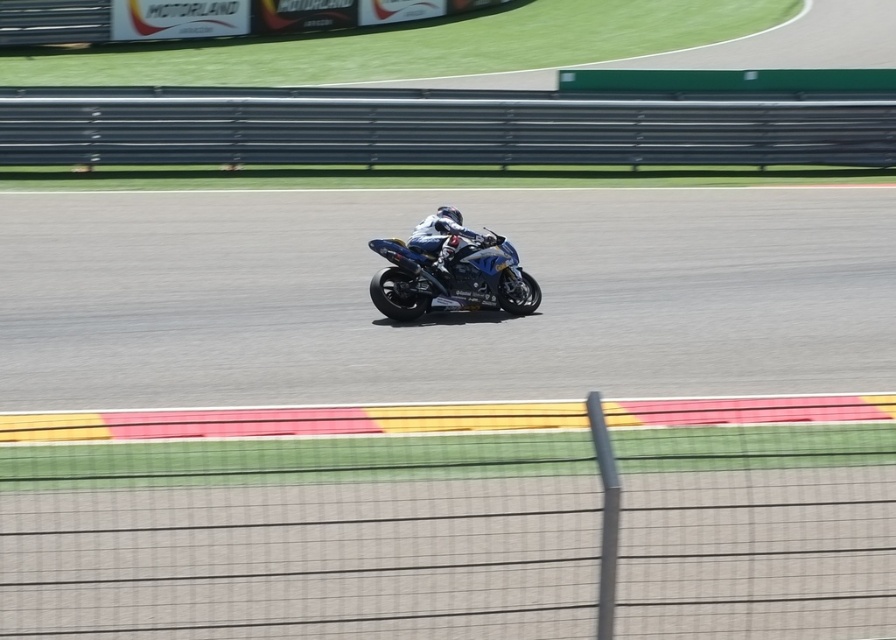
Question: Is blue metallic motorcycle at center positioned behind white matte helmet at center?

Choices:
 (A) yes
 (B) no

Answer: (B)

Question: Among these points, which one is nearest to the camera?

Choices:
 (A) (468, 236)
 (B) (526, 308)

Answer: (A)

Question: Does blue metallic motorcycle at center appear on the right side of white matte helmet at center?

Choices:
 (A) yes
 (B) no

Answer: (A)

Question: Can you confirm if blue metallic motorcycle at center is smaller than white matte helmet at center?

Choices:
 (A) yes
 (B) no

Answer: (B)

Question: Which point is closer to the camera?

Choices:
 (A) blue metallic motorcycle at center
 (B) white matte helmet at center

Answer: (A)